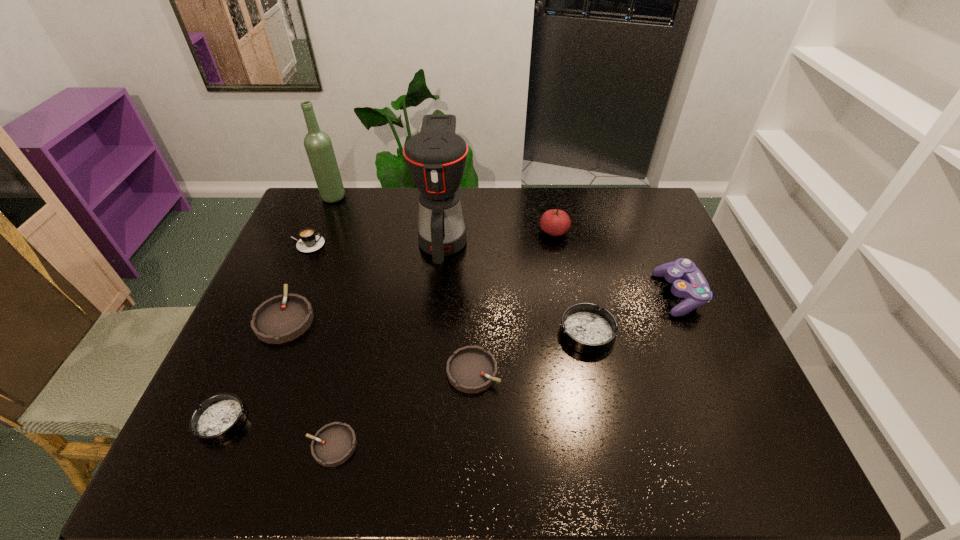
At what (x,y) coordinates should I click in order to perform the action: click on wine bottle at the left edge. Please return your answer as a coordinate pair (x, y). This screenshot has width=960, height=540. Looking at the image, I should click on (318, 145).

I want to click on cappuccino at the left edge, so click(309, 242).

Where is `object located at the right edge`? This screenshot has height=540, width=960. object located at the right edge is located at coordinates (688, 281).

Where is `object that is at the far left corner`? object that is at the far left corner is located at coordinates (318, 145).

The width and height of the screenshot is (960, 540). In order to click on object that is at the near left corner in this screenshot , I will do `click(219, 417)`.

Find the location of a particular element. The height and width of the screenshot is (540, 960). free space at the far edge of the desktop is located at coordinates (603, 197).

Find the location of a particular element. The width and height of the screenshot is (960, 540). blank space at the near edge of the desktop is located at coordinates (280, 475).

This screenshot has height=540, width=960. In the image, there is a desktop. Identify the location of vacant region at the left edge. (273, 362).

I want to click on vacant region at the right edge of the desktop, so click(x=672, y=237).

In the image, there is a desktop. Where is `free space at the far left corner`? free space at the far left corner is located at coordinates (316, 206).